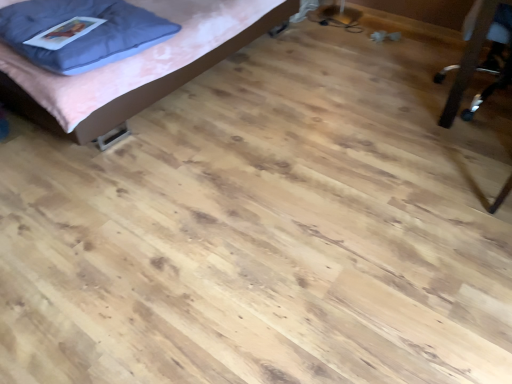
Question: Does metallic silver chair at right come in front of blue fabric pillow at upper left?

Choices:
 (A) no
 (B) yes

Answer: (B)

Question: From the image's perspective, would you say metallic silver chair at right is shown under blue fabric pillow at upper left?

Choices:
 (A) no
 (B) yes

Answer: (B)

Question: From the image's perspective, is metallic silver chair at right over blue fabric pillow at upper left?

Choices:
 (A) no
 (B) yes

Answer: (A)

Question: Does metallic silver chair at right have a greater height compared to blue fabric pillow at upper left?

Choices:
 (A) no
 (B) yes

Answer: (B)

Question: Considering the relative sizes of metallic silver chair at right and blue fabric pillow at upper left in the image provided, is metallic silver chair at right thinner than blue fabric pillow at upper left?

Choices:
 (A) no
 (B) yes

Answer: (A)

Question: Looking at their shapes, would you say metallic silver chair at right is wider or thinner than blue fabric pillow at upper left?

Choices:
 (A) wide
 (B) thin

Answer: (A)

Question: From a real-world perspective, is metallic silver chair at right above or below blue fabric pillow at upper left?

Choices:
 (A) above
 (B) below

Answer: (B)

Question: From the image's perspective, relative to blue fabric pillow at upper left, is metallic silver chair at right above or below?

Choices:
 (A) above
 (B) below

Answer: (B)

Question: Is metallic silver chair at right inside or outside of blue fabric pillow at upper left?

Choices:
 (A) outside
 (B) inside

Answer: (A)

Question: Considering the positions of matte pink bed at upper left and blue fabric pillow at upper left in the image, is matte pink bed at upper left wider or thinner than blue fabric pillow at upper left?

Choices:
 (A) wide
 (B) thin

Answer: (A)

Question: From the image's perspective, relative to blue fabric pillow at upper left, is matte pink bed at upper left above or below?

Choices:
 (A) above
 (B) below

Answer: (A)

Question: Visually, is matte pink bed at upper left positioned to the left or to the right of blue fabric pillow at upper left?

Choices:
 (A) right
 (B) left

Answer: (A)

Question: Is matte pink bed at upper left inside the boundaries of blue fabric pillow at upper left, or outside?

Choices:
 (A) inside
 (B) outside

Answer: (B)

Question: Does point (71, 69) appear closer or farther from the camera than point (221, 49)?

Choices:
 (A) closer
 (B) farther

Answer: (A)

Question: Looking at their shapes, would you say blue fabric pillow at upper left is wider or thinner than matte pink bed at upper left?

Choices:
 (A) wide
 (B) thin

Answer: (B)